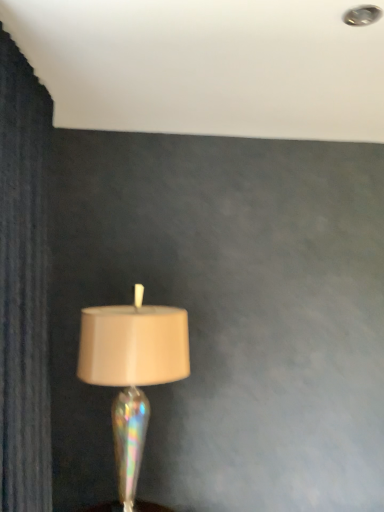
Identify the location of iridescent glass lamp at center. This screenshot has width=384, height=512. (132, 377).

What do you see at coordinates (132, 377) in the screenshot? I see `iridescent glass lamp at center` at bounding box center [132, 377].

Where is `iridescent glass lamp at center`? This screenshot has height=512, width=384. iridescent glass lamp at center is located at coordinates (132, 377).